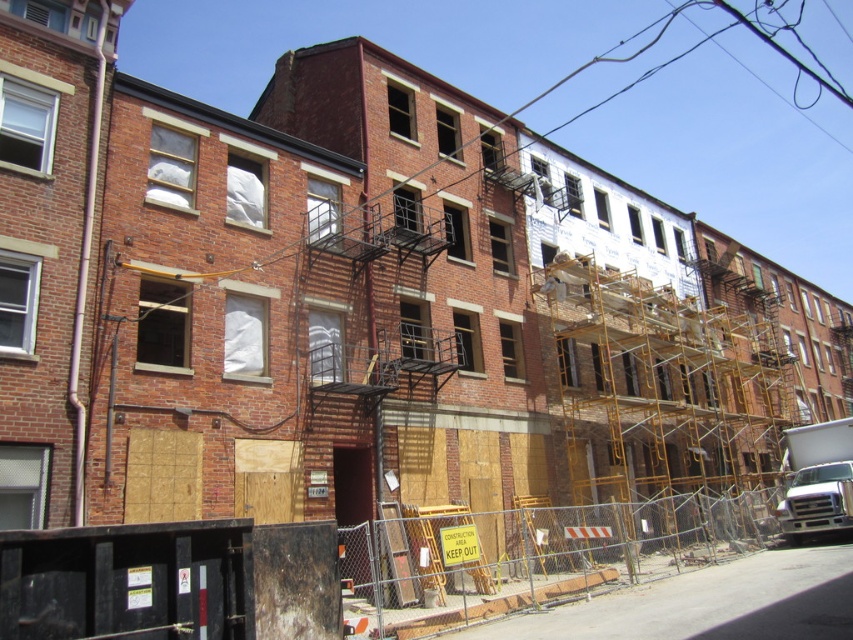
You are standing in front of the construction site and notice two points marked on the buildings. The first point is at coordinates point (772, 408) and the second is at point (412, 609). Which point is closer to you?

Point (772, 408) is closer to you because it is further to the viewer than point (412, 609).

You are a delivery person trying to navigate through the construction site. You see the yellow metal scaffolding at center and the metal mesh fence at lower center. Which structure is wider in terms of their widths?

The yellow metal scaffolding at center is wider than the metal mesh fence at lower center.